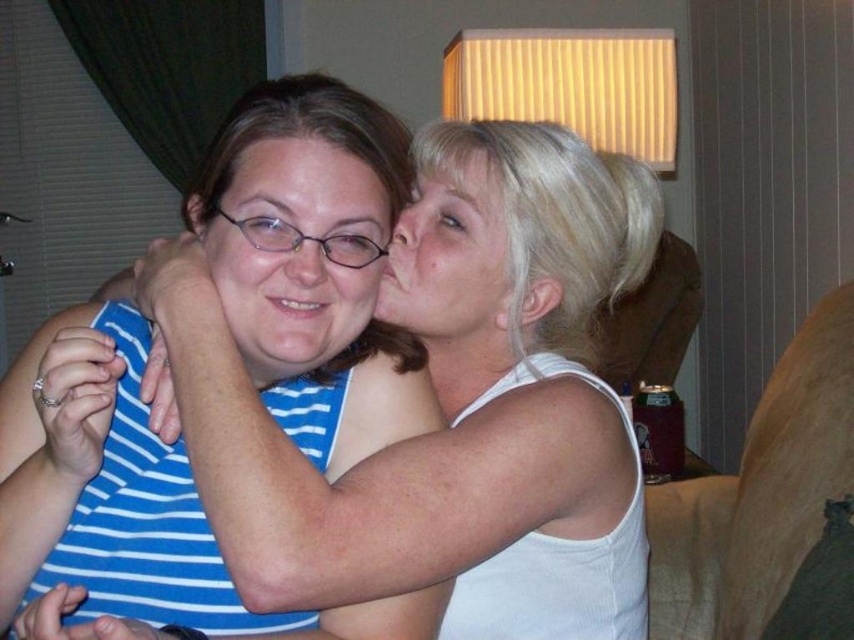
You are a photographer trying to capture a candid shot of the two people in the scene. Your camera has a minimum focusing distance of 15 centimeters. Can you take a clear photo of both the matte blue striped shirt at center and the matte white face at upper right without moving the subjects?

The distance between the matte blue striped shirt at center and the matte white face at upper right is 15.31 centimeters, which is just over the camera minimum focusing distance of 15 centimeters. Therefore, the camera can focus on both subjects and take a clear photo without needing to move them.

What are the coordinates of the matte blue striped shirt at center?

The coordinates of the matte blue striped shirt at center are at point (x=297, y=250).